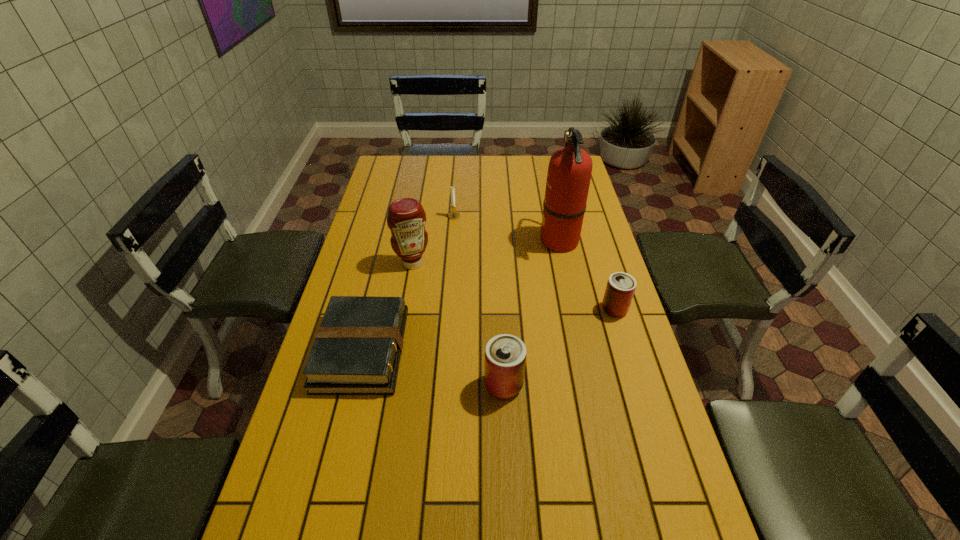
Identify the location of unoccupied area between the farthest object and the tallest object. This screenshot has width=960, height=540. (507, 228).

Locate an element on the screen. The height and width of the screenshot is (540, 960). unoccupied area between the nearer can and the shorter can is located at coordinates (559, 347).

You are a GUI agent. You are given a task and a screenshot of the screen. Output one action in this format:
    pyautogui.click(x=<x>, y=<y>)
    Task: Click on the free area in between the hardback book and the tallest object
    
    Given the screenshot: What is the action you would take?
    pyautogui.click(x=461, y=295)

At what (x,y) coordinates should I click in order to perform the action: click on unoccupied area between the farther can and the candle holder. Please return your answer as a coordinate pair (x, y). Looking at the image, I should click on (535, 262).

I want to click on vacant area that lies between the third object from left to right and the condiment, so click(x=433, y=240).

Find the location of a particular element. This screenshot has width=960, height=540. the third closest object to the taller can is located at coordinates (406, 218).

Choose which object is the fourth nearest neighbor to the taller can. Please provide its 2D coordinates. Your answer should be formatted as a tuple, i.e. [(x, y)], where the tuple contains the x and y coordinates of a point satisfying the conditions above.

[(569, 173)]

I want to click on vacant area in the image that satisfies the following two spatial constraints: 1. on the spine side of the left can; 2. on the left side of the shortest object, so click(x=353, y=385).

At what (x,y) coordinates should I click in order to perform the action: click on vacant area in the image that satisfies the following two spatial constraints: 1. on the front side of the condiment; 2. on the right side of the farther can. Please return your answer as a coordinate pair (x, y). Looking at the image, I should click on (405, 309).